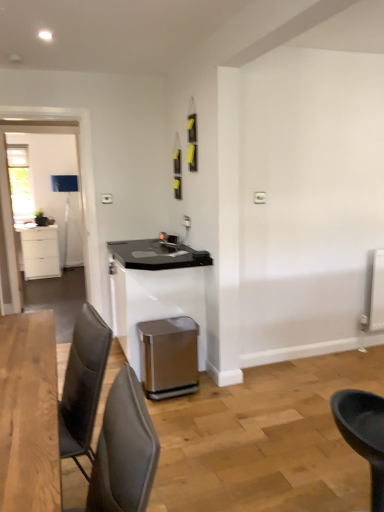
Question: Is clear glass door at left in front of black plastic chair at lower right, placed as the first chair when sorted from right to left?

Choices:
 (A) no
 (B) yes

Answer: (A)

Question: Is clear glass door at left shorter than black plastic chair at lower right, placed as the first chair when sorted from right to left?

Choices:
 (A) no
 (B) yes

Answer: (A)

Question: Is clear glass door at left aimed at black plastic chair at lower right, the 2th chair when ordered from left to right?

Choices:
 (A) yes
 (B) no

Answer: (B)

Question: Is clear glass door at left oriented away from black plastic chair at lower right, placed as the first chair when sorted from back to front?

Choices:
 (A) no
 (B) yes

Answer: (A)

Question: Is there a large distance between clear glass door at left and black plastic chair at lower right, the second chair in the front-to-back sequence?

Choices:
 (A) no
 (B) yes

Answer: (B)

Question: In terms of width, does satin metallic trash can at lower center look wider or thinner when compared to gray fabric chair at lower left, the 2th chair positioned from the back?

Choices:
 (A) wide
 (B) thin

Answer: (A)

Question: Is point 152,361 positioned closer to the camera than point 147,480?

Choices:
 (A) closer
 (B) farther

Answer: (B)

Question: From the image's perspective, is satin metallic trash can at lower center positioned above or below gray fabric chair at lower left, the first chair positioned from the left?

Choices:
 (A) below
 (B) above

Answer: (A)

Question: Looking at the image, does satin metallic trash can at lower center seem bigger or smaller compared to gray fabric chair at lower left, the 2th chair in the right-to-left sequence?

Choices:
 (A) small
 (B) big

Answer: (A)

Question: From their relative heights in the image, would you say gray fabric chair at lower left, the first chair positioned from the left, is taller or shorter than black plastic chair at lower right, the second chair in the front-to-back sequence?

Choices:
 (A) short
 (B) tall

Answer: (A)

Question: In the image, is gray fabric chair at lower left, the 2th chair positioned from the back, positioned in front of or behind black plastic chair at lower right, the 2th chair when ordered from left to right?

Choices:
 (A) front
 (B) behind

Answer: (A)

Question: From the image's perspective, is gray fabric chair at lower left, the 1th chair in the front-to-back sequence, above or below black plastic chair at lower right, the second chair in the front-to-back sequence?

Choices:
 (A) above
 (B) below

Answer: (A)

Question: Is gray fabric chair at lower left, the 1th chair in the front-to-back sequence, to the left or to the right of black plastic chair at lower right, placed as the first chair when sorted from back to front, in the image?

Choices:
 (A) left
 (B) right

Answer: (A)

Question: From a real-world perspective, is satin white table at center positioned above or below satin metallic trash can at lower center?

Choices:
 (A) above
 (B) below

Answer: (A)

Question: Which is correct: satin white table at center is inside satin metallic trash can at lower center, or outside of it?

Choices:
 (A) inside
 (B) outside

Answer: (B)